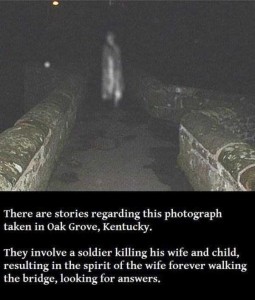
Find the location of a particular element. The image size is (255, 300). wall is located at coordinates pos(43,145), pos(207,149), pos(159,96).